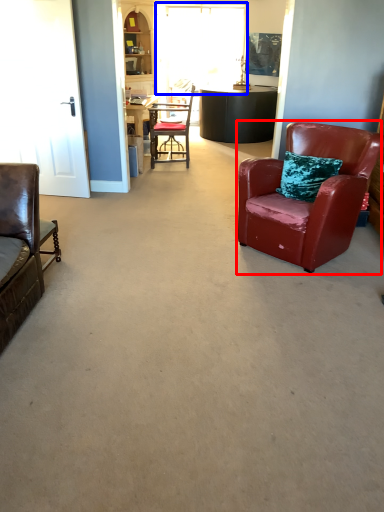
Question: Which object is closer to the camera taking this photo, chair (highlighted by a red box) or window (highlighted by a blue box)?

Choices:
 (A) chair
 (B) window

Answer: (A)